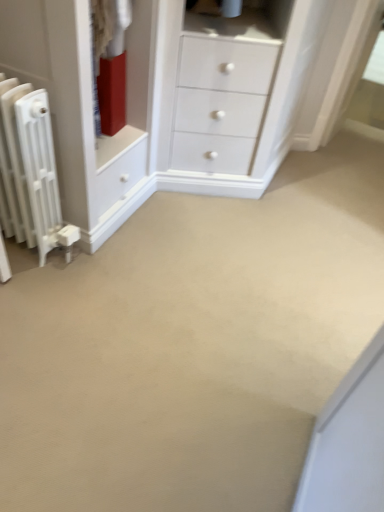
Question: Could you tell me if matte white chest of drawers at left is turned towards white matte radiator at left?

Choices:
 (A) yes
 (B) no

Answer: (B)

Question: From a real-world perspective, is matte white chest of drawers at left on top of white matte radiator at left?

Choices:
 (A) yes
 (B) no

Answer: (A)

Question: From a real-world perspective, does matte white chest of drawers at left sit lower than white matte radiator at left?

Choices:
 (A) no
 (B) yes

Answer: (A)

Question: Is matte white chest of drawers at left positioned in front of white matte radiator at left?

Choices:
 (A) yes
 (B) no

Answer: (B)

Question: Is matte white chest of drawers at left placed right next to white matte radiator at left?

Choices:
 (A) no
 (B) yes

Answer: (A)

Question: Can you confirm if matte white chest of drawers at left is taller than white matte radiator at left?

Choices:
 (A) yes
 (B) no

Answer: (B)

Question: Is matte white chest of drawers at left located within white matte radiator at left?

Choices:
 (A) no
 (B) yes

Answer: (A)

Question: Does white matte radiator at left come in front of matte white chest of drawers at left?

Choices:
 (A) no
 (B) yes

Answer: (B)

Question: Is white matte radiator at left outside matte white chest of drawers at left?

Choices:
 (A) no
 (B) yes

Answer: (B)

Question: Is white matte radiator at left smaller than matte white chest of drawers at left?

Choices:
 (A) yes
 (B) no

Answer: (A)

Question: Is white matte radiator at left with matte white chest of drawers at left?

Choices:
 (A) yes
 (B) no

Answer: (B)

Question: Considering the relative sizes of white matte radiator at left and matte white chest of drawers at left in the image provided, is white matte radiator at left bigger than matte white chest of drawers at left?

Choices:
 (A) yes
 (B) no

Answer: (B)

Question: Considering the positions of matte white chest of drawers at left and white matte radiator at left in the image, is matte white chest of drawers at left bigger or smaller than white matte radiator at left?

Choices:
 (A) big
 (B) small

Answer: (A)